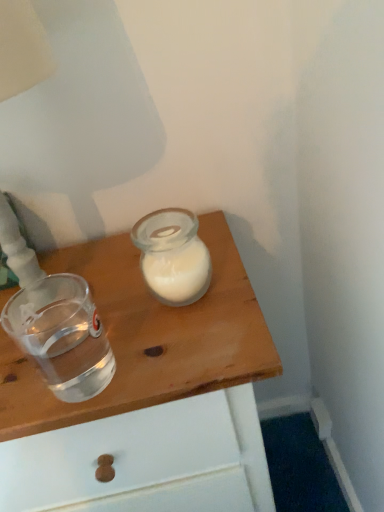
The image size is (384, 512). I want to click on free space to the back side of transparent plastic shot glass at left, so click(92, 293).